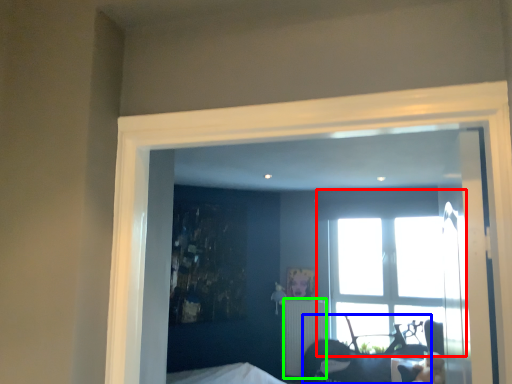
Question: Considering the real-world distances, which object is farthest from window (highlighted by a red box)? furniture (highlighted by a blue box) or radiator (highlighted by a green box)?

Choices:
 (A) furniture
 (B) radiator

Answer: (B)